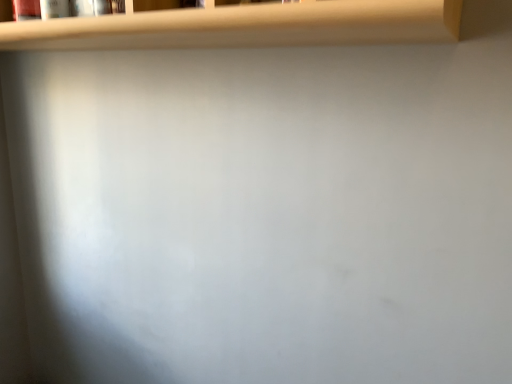
What is the approximate width of white matte shelf at upper center?

It is 10.74 inches.

The width and height of the screenshot is (512, 384). What do you see at coordinates (246, 26) in the screenshot?
I see `white matte shelf at upper center` at bounding box center [246, 26].

This screenshot has width=512, height=384. I want to click on white matte shelf at upper center, so pyautogui.click(x=246, y=26).

Where is `white matte shelf at upper center`? Image resolution: width=512 pixels, height=384 pixels. white matte shelf at upper center is located at coordinates (246, 26).